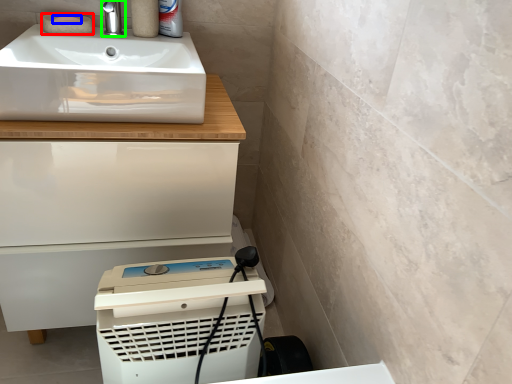
Question: Which is farther away from soap (highlighted by a red box)? soap (highlighted by a blue box) or tap (highlighted by a green box)?

Choices:
 (A) soap
 (B) tap

Answer: (B)